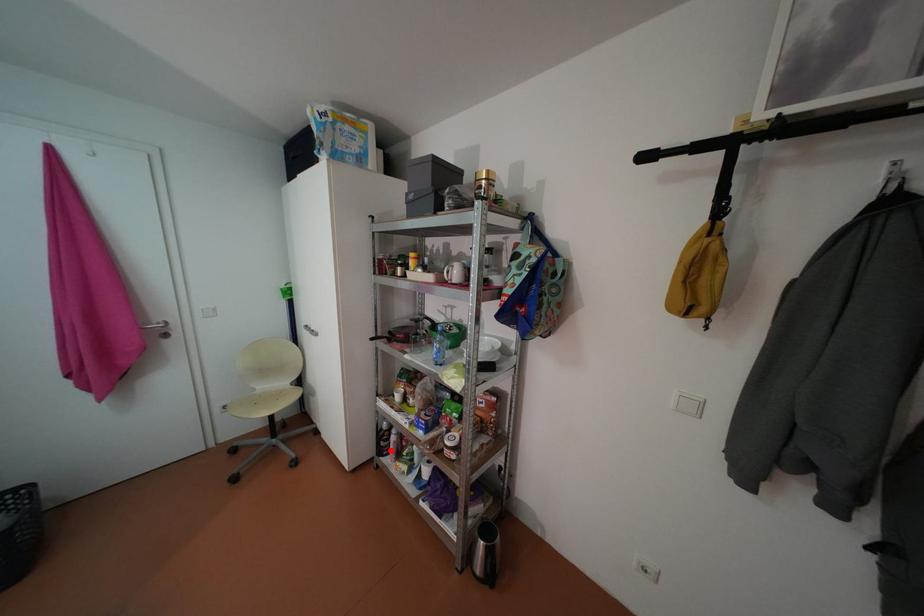
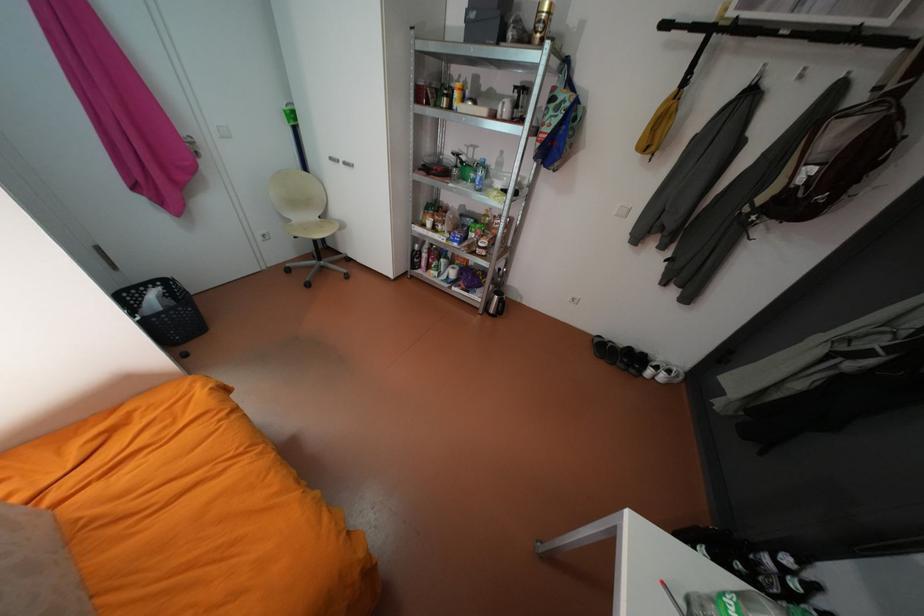
The point at the highlighted location is marked in the first image. Where is the corresponding point in the second image?

(423, 265)